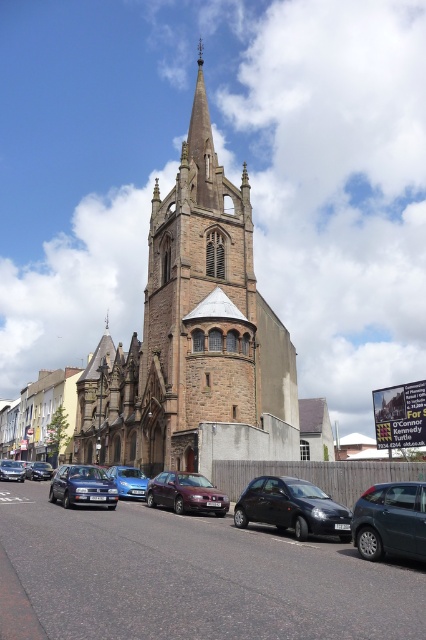
Is point (58, 481) in front of point (32, 476)?

That is True.

Which is behind, point (63, 486) or point (36, 476)?

Point (36, 476)

At what (x,y) coordinates should I click in order to perform the action: click on metallic blue sedan at lower left. Please return your answer as a coordinate pair (x, y). The height and width of the screenshot is (640, 426). Looking at the image, I should click on (83, 486).

Is brown stone tower at center further to camera compared to matte black car at center?

No.

Who is positioned more to the left, brown stone tower at center or matte black car at center?

Positioned to the left is matte black car at center.

Which is in front, point (265, 412) or point (32, 480)?

Point (265, 412) is in front.

The height and width of the screenshot is (640, 426). I want to click on brown stone tower at center, so click(189, 326).

Can you confirm if satin burgundy sedan at center is positioned below metallic blue sedan at center?

No, satin burgundy sedan at center is not below metallic blue sedan at center.

Who is higher up, satin burgundy sedan at center or metallic blue sedan at center?

Positioned higher is satin burgundy sedan at center.

Between point (192, 508) and point (22, 480), which one is positioned in front?

Positioned in front is point (192, 508).

Find the location of a particular element. satin burgundy sedan at center is located at coordinates (186, 493).